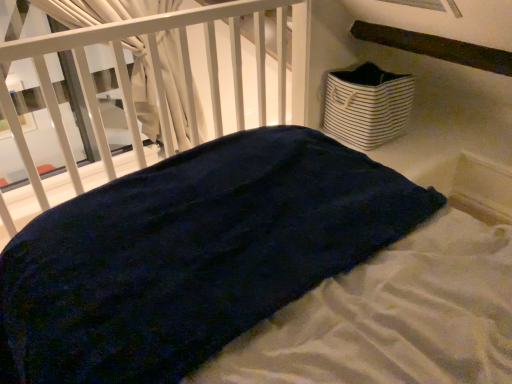
What do you see at coordinates (158, 71) in the screenshot?
I see `dark blue plush at center` at bounding box center [158, 71].

Measure the distance between dark blue plush at center and camera.

A distance of 1.23 meters exists between dark blue plush at center and camera.

The height and width of the screenshot is (384, 512). I want to click on dark blue plush at center, so click(158, 71).

The image size is (512, 384). Describe the element at coordinates (367, 105) in the screenshot. I see `white striped fabric basket at upper right` at that location.

Locate an element on the screen. The height and width of the screenshot is (384, 512). white striped fabric basket at upper right is located at coordinates (367, 105).

This screenshot has height=384, width=512. In order to click on dark blue plush at center in this screenshot , I will do `click(158, 71)`.

Which object is positioned more to the right, dark blue plush at center or white striped fabric basket at upper right?

From the viewer's perspective, white striped fabric basket at upper right appears more on the right side.

Relative to white striped fabric basket at upper right, is dark blue plush at center in front or behind?

In the image, dark blue plush at center appears in front of white striped fabric basket at upper right.

Between point (67, 38) and point (340, 81), which one is positioned behind?

The point (340, 81) is more distant.

From the image's perspective, does dark blue plush at center appear higher than white striped fabric basket at upper right?

No, from the image's perspective, dark blue plush at center is not on top of white striped fabric basket at upper right.

From a real-world perspective, is dark blue plush at center physically located above or below white striped fabric basket at upper right?

Clearly, from a real-world perspective, dark blue plush at center is above white striped fabric basket at upper right.

Does dark blue plush at center have a lesser width compared to white striped fabric basket at upper right?

No.

Does dark blue plush at center have a lesser height compared to white striped fabric basket at upper right?

No, dark blue plush at center is not shorter than white striped fabric basket at upper right.

Which of these two, dark blue plush at center or white striped fabric basket at upper right, is smaller?

With smaller size is white striped fabric basket at upper right.

Is dark blue plush at center inside the boundaries of white striped fabric basket at upper right, or outside?

dark blue plush at center is spatially situated outside white striped fabric basket at upper right.

Is dark blue plush at center next to white striped fabric basket at upper right and touching it?

No, dark blue plush at center is not in contact with white striped fabric basket at upper right.

Could you tell me if dark blue plush at center is facing white striped fabric basket at upper right?

No.

How many degrees apart are the facing directions of dark blue plush at center and white striped fabric basket at upper right?

The facing directions of dark blue plush at center and white striped fabric basket at upper right are 175 degrees apart.

How far apart are dark blue plush at center and white striped fabric basket at upper right?

23.17 inches.

The image size is (512, 384). Find the location of `infant bed above the white striped fabric basket at upper right (from a real-world perspective)`. infant bed above the white striped fabric basket at upper right (from a real-world perspective) is located at coordinates (158, 71).

Can you confirm if white striped fabric basket at upper right is positioned to the right of dark blue plush at center?

Yes, white striped fabric basket at upper right is to the right of dark blue plush at center.

Does white striped fabric basket at upper right come in front of dark blue plush at center?

No, white striped fabric basket at upper right is further to the viewer.

Does point (388, 126) lie in front of point (191, 91)?

No, it is not.

From the image's perspective, which one is positioned higher, white striped fabric basket at upper right or dark blue plush at center?

white striped fabric basket at upper right, from the image's perspective.

From a real-world perspective, is white striped fabric basket at upper right under dark blue plush at center?

Yes.

From the picture: Between white striped fabric basket at upper right and dark blue plush at center, which one has larger width?

With larger width is dark blue plush at center.

Does white striped fabric basket at upper right have a lesser height compared to dark blue plush at center?

Yes.

Who is smaller, white striped fabric basket at upper right or dark blue plush at center?

white striped fabric basket at upper right is smaller.

Is white striped fabric basket at upper right inside the boundaries of dark blue plush at center, or outside?

white striped fabric basket at upper right is spatially situated outside dark blue plush at center.

Is white striped fabric basket at upper right positioned far away from dark blue plush at center?

white striped fabric basket at upper right is actually quite close to dark blue plush at center.

Is white striped fabric basket at upper right aimed at dark blue plush at center?

Yes, white striped fabric basket at upper right is aimed at dark blue plush at center.

I want to click on infant bed that appears in front of the white striped fabric basket at upper right, so click(x=158, y=71).

Where is `basket that is under the dark blue plush at center (from a real-world perspective)`? This screenshot has height=384, width=512. basket that is under the dark blue plush at center (from a real-world perspective) is located at coordinates (367, 105).

Find the location of `basket that appears on the right of dark blue plush at center`. basket that appears on the right of dark blue plush at center is located at coordinates 367,105.